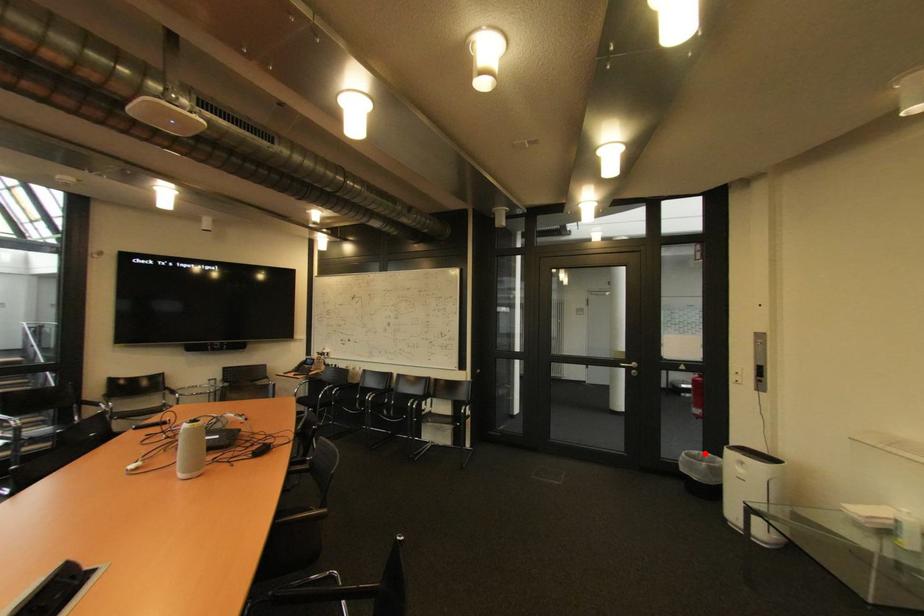
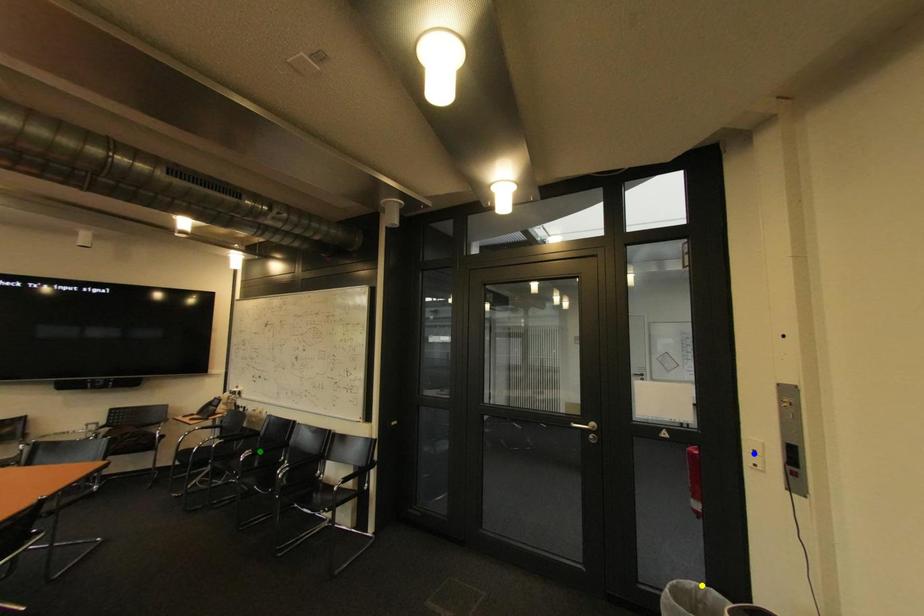
Question: I am providing you with two images of the same scene from different viewpoints. A red point is marked on the first image. You are given multiple points on the second image. Can you choose the point in image 2 that corresponds to the point in image 1?

Choices:
 (A) blue point
 (B) green point
 (C) yellow point

Answer: (C)